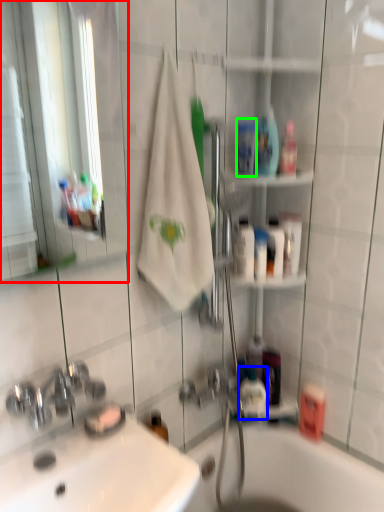
Question: Considering the real-world distances, which object is farthest from mirror (highlighted by a red box)? mouthwash (highlighted by a blue box) or mouthwash (highlighted by a green box)?

Choices:
 (A) mouthwash
 (B) mouthwash

Answer: (A)